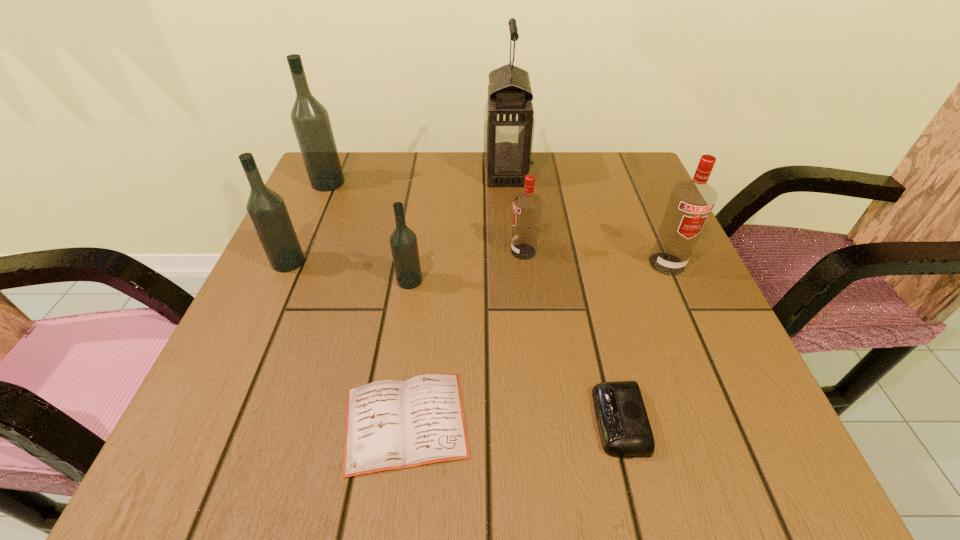
You are a GUI agent. You are given a task and a screenshot of the screen. Output one action in this format:
    pyautogui.click(x=<x>, y=<y>)
    Task: Click on the vacant region located 0.130m on the front label of the fourth vodka from left to right
    The width and height of the screenshot is (960, 540).
    Given the screenshot: What is the action you would take?
    pyautogui.click(x=447, y=252)

Where is `vacant space situated 0.180m on the front label of the fourth vodka from left to right`? The width and height of the screenshot is (960, 540). vacant space situated 0.180m on the front label of the fourth vodka from left to right is located at coordinates (423, 252).

Identify the location of free region located 0.060m on the front label of the fourth vodka from left to right. Image resolution: width=960 pixels, height=540 pixels. (481, 252).

Where is `free region located 0.200m on the back of the smallest black vodka`? The width and height of the screenshot is (960, 540). free region located 0.200m on the back of the smallest black vodka is located at coordinates (420, 211).

In order to click on vacant space located on the display of the seventh object from left to right in this screenshot , I will do `click(481, 421)`.

This screenshot has width=960, height=540. In order to click on free space located 0.330m on the display of the seventh object from left to right in this screenshot , I will do `click(372, 421)`.

Find the location of a particular element. The height and width of the screenshot is (540, 960). vacant space located on the display of the seventh object from left to right is located at coordinates (535, 421).

Locate an element on the screen. This screenshot has width=960, height=540. vacant space located 0.120m on the right of the shortest object is located at coordinates (552, 422).

Identify the location of lantern that is positioned at the far edge. (509, 120).

Find the location of a particular element. This screenshot has height=540, width=960. vodka that is at the far edge is located at coordinates (310, 119).